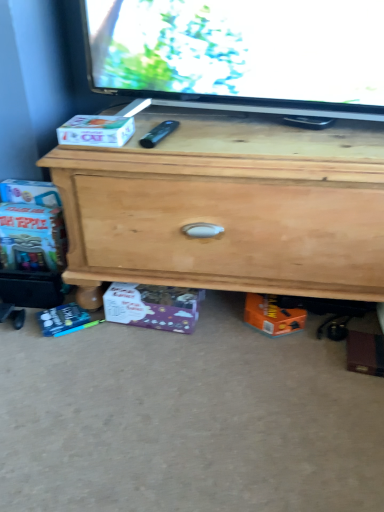
Consider the image. Measure the distance between point (x=130, y=135) and camera.

They are 39.33 inches apart.

Measure the distance between natural wood chest of drawers at center and camera.

The depth of natural wood chest of drawers at center is 36.20 inches.

At what (x,y) coordinates should I click in order to perform the action: click on white cardboard box at left, the 1th box in the top-to-bottom sequence. Please return your answer as a coordinate pair (x, y). The width and height of the screenshot is (384, 512). Looking at the image, I should click on (96, 131).

Does point (70, 247) come farther from viewer compared to point (161, 300)?

No.

Is natural wood chest of drawers at center positioned beyond the bounds of purple cardboard box at lower center, acting as the first box starting from the back?

That's correct, natural wood chest of drawers at center is outside of purple cardboard box at lower center, acting as the first box starting from the back.

Is natural wood chest of drawers at center with purple cardboard box at lower center, the 2th box from the front?

No, natural wood chest of drawers at center is not with purple cardboard box at lower center, the 2th box from the front.

Is natural wood chest of drawers at center positioned with its back to purple cardboard box at lower center, acting as the first box starting from the back?

No, purple cardboard box at lower center, acting as the first box starting from the back, is not at the back of natural wood chest of drawers at center.

From a real-world perspective, who is located lower, purple cardboard box at lower center, acting as the first box starting from the back, or natural wood chest of drawers at center?

purple cardboard box at lower center, acting as the first box starting from the back.

This screenshot has height=512, width=384. What are the coordinates of `the chest of drawers that appears above the purple cardboard box at lower center, the 2th box from the front (from a real-world perspective)` in the screenshot? It's located at (228, 207).

Does purple cardboard box at lower center, the 2th box from the front, appear on the right side of natural wood chest of drawers at center?

In fact, purple cardboard box at lower center, the 2th box from the front, is to the left of natural wood chest of drawers at center.

Does purple cardboard box at lower center, positioned as the 1th box in bottom-to-top order, have a larger size compared to natural wood chest of drawers at center?

No, purple cardboard box at lower center, positioned as the 1th box in bottom-to-top order, is not bigger than natural wood chest of drawers at center.

Is the depth of natural wood chest of drawers at center less than that of white cardboard box at left, which is counted as the second box, starting from the back?

Yes, it is.

Is the surface of natural wood chest of drawers at center in direct contact with white cardboard box at left, which is the 1th box from front to back?

natural wood chest of drawers at center and white cardboard box at left, which is the 1th box from front to back, are not in contact.

Which of these two, white cardboard box at left, positioned as the 2th box in bottom-to-top order, or natural wood chest of drawers at center, is thinner?

white cardboard box at left, positioned as the 2th box in bottom-to-top order.

Between white cardboard box at left, which is the 1th box from front to back, and natural wood chest of drawers at center, which one has less height?

Standing shorter between the two is white cardboard box at left, which is the 1th box from front to back.

Are white cardboard box at left, the 1th box in the top-to-bottom sequence, and natural wood chest of drawers at center beside each other?

No, white cardboard box at left, the 1th box in the top-to-bottom sequence, is not making contact with natural wood chest of drawers at center.

Could you tell me if white cardboard box at left, the 1th box in the top-to-bottom sequence, is facing natural wood chest of drawers at center?

No, white cardboard box at left, the 1th box in the top-to-bottom sequence, does not turn towards natural wood chest of drawers at center.

From the image's perspective, which one is positioned lower, white cardboard box at left, which is counted as the second box, starting from the back, or purple cardboard box at lower center, the 2th box from the front?

purple cardboard box at lower center, the 2th box from the front.

Where is `box below the white cardboard box at left, positioned as the 2th box in bottom-to-top order (from the image's perspective)`? Image resolution: width=384 pixels, height=512 pixels. box below the white cardboard box at left, positioned as the 2th box in bottom-to-top order (from the image's perspective) is located at coordinates (153, 306).

Is white cardboard box at left, positioned as the 2th box in bottom-to-top order, directly adjacent to purple cardboard box at lower center, the 2th box from the front?

No, white cardboard box at left, positioned as the 2th box in bottom-to-top order, is not beside purple cardboard box at lower center, the 2th box from the front.

Who is bigger, white cardboard box at left, positioned as the 2th box in bottom-to-top order, or purple cardboard box at lower center, acting as the first box starting from the back?

With larger size is purple cardboard box at lower center, acting as the first box starting from the back.

Would you say purple cardboard box at lower center, positioned as the 1th box in bottom-to-top order, is inside or outside white cardboard box at left, which is the 1th box from front to back?

purple cardboard box at lower center, positioned as the 1th box in bottom-to-top order, cannot be found inside white cardboard box at left, which is the 1th box from front to back.

Is purple cardboard box at lower center, positioned as the 2th box in top-to-bottom order, far from white cardboard box at left, which is counted as the second box, starting from the back?

purple cardboard box at lower center, positioned as the 2th box in top-to-bottom order, is near white cardboard box at left, which is counted as the second box, starting from the back, not far away.

How many degrees apart are the facing directions of purple cardboard box at lower center, the 2th box from the front, and white cardboard box at left, which is the 1th box from front to back?

purple cardboard box at lower center, the 2th box from the front, and white cardboard box at left, which is the 1th box from front to back, are facing 6.4 degrees away from each other.

At what (x,y) coordinates should I click in order to perform the action: click on the 2nd box behind the natural wood chest of drawers at center. Please return your answer as a coordinate pair (x, y). The image size is (384, 512). Looking at the image, I should click on (153, 306).

In order to click on the chest of drawers lying in front of the purple cardboard box at lower center, positioned as the 1th box in bottom-to-top order in this screenshot , I will do `click(228, 207)`.

Looking at the image, which one is located further to natural wood chest of drawers at center, purple cardboard box at lower center, acting as the first box starting from the back, or white cardboard box at left, positioned as the 2th box in bottom-to-top order?

white cardboard box at left, positioned as the 2th box in bottom-to-top order.

Considering their positions, is white cardboard box at left, positioned as the 2th box in bottom-to-top order, positioned further to natural wood chest of drawers at center than purple cardboard box at lower center, acting as the first box starting from the back?

white cardboard box at left, positioned as the 2th box in bottom-to-top order, lies further to natural wood chest of drawers at center than the other object.

Looking at the image, which one is located closer to purple cardboard box at lower center, positioned as the 1th box in bottom-to-top order, white cardboard box at left, the 1th box in the top-to-bottom sequence, or natural wood chest of drawers at center?

Based on the image, natural wood chest of drawers at center appears to be nearer to purple cardboard box at lower center, positioned as the 1th box in bottom-to-top order.

Estimate the real-world distances between objects in this image. Which object is further from white cardboard box at left, which is the 1th box from front to back, purple cardboard box at lower center, acting as the first box starting from the back, or natural wood chest of drawers at center?

The object further to white cardboard box at left, which is the 1th box from front to back, is purple cardboard box at lower center, acting as the first box starting from the back.

From the picture: From the image, which object appears to be farther from white cardboard box at left, which is counted as the second box, starting from the back, natural wood chest of drawers at center or purple cardboard box at lower center, acting as the first box starting from the back?

purple cardboard box at lower center, acting as the first box starting from the back, is positioned further to the anchor white cardboard box at left, which is counted as the second box, starting from the back.

Considering their positions, is natural wood chest of drawers at center positioned closer to purple cardboard box at lower center, positioned as the 2th box in top-to-bottom order, than white cardboard box at left, positioned as the 2th box in bottom-to-top order?

natural wood chest of drawers at center.

Locate an element on the screen. This screenshot has width=384, height=512. chest of drawers between white cardboard box at left, which is the 1th box from front to back, and purple cardboard box at lower center, the 2th box from the front, from top to bottom is located at coordinates (228, 207).